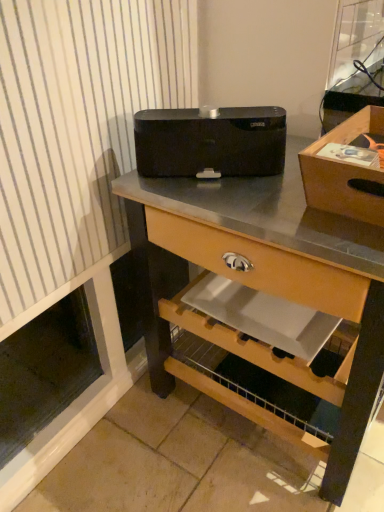
Question: Does point (263, 108) appear closer or farther from the camera than point (216, 195)?

Choices:
 (A) farther
 (B) closer

Answer: (A)

Question: From their relative heights in the image, would you say black matte speaker at center is taller or shorter than black matte speaker at center?

Choices:
 (A) short
 (B) tall

Answer: (A)

Question: Which of these objects is positioned closest to the black matte speaker at center?

Choices:
 (A) black matte speaker at center
 (B) wooden box at upper right

Answer: (A)

Question: Which of these objects is positioned closest to the black matte speaker at center?

Choices:
 (A) black matte speaker at center
 (B) wooden box at upper right

Answer: (A)